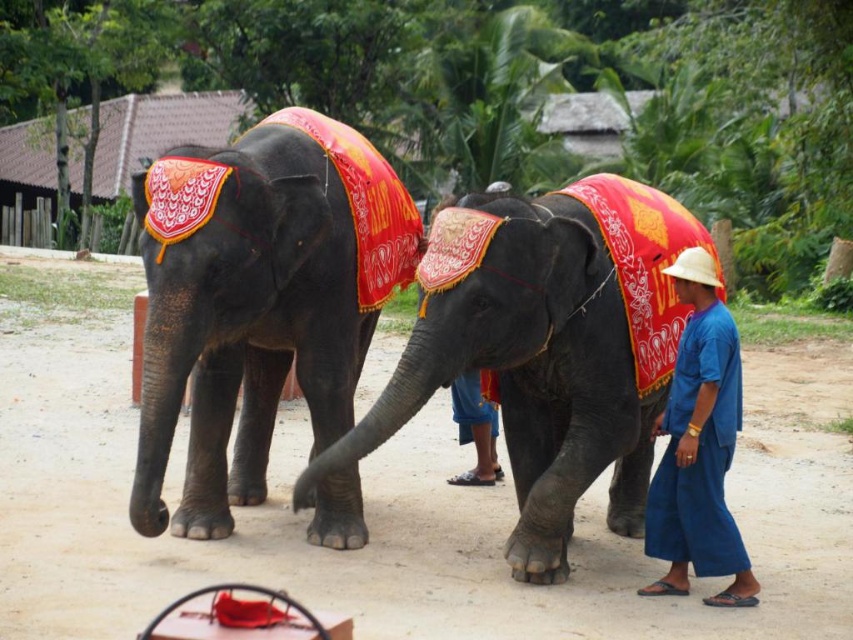
You are a traveler on a dirt track and see the shiny red clothed elephant at center. Which direction should you go to reach the brown dirt track at center from the elephant?

The brown dirt track at center is in front of the shiny red clothed elephant at center, so you should go forward towards it to reach the brown dirt track at center.